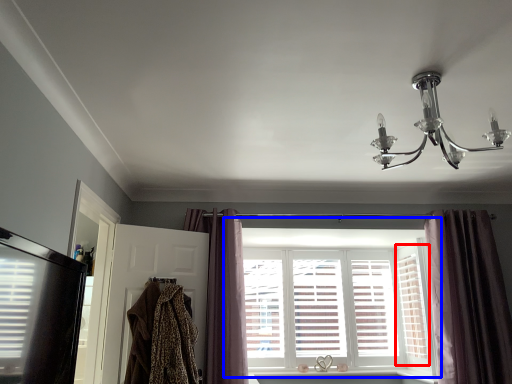
Question: Which point is closer to the camera, shutter (highlighted by a red box) or window (highlighted by a blue box)?

Choices:
 (A) shutter
 (B) window

Answer: (A)